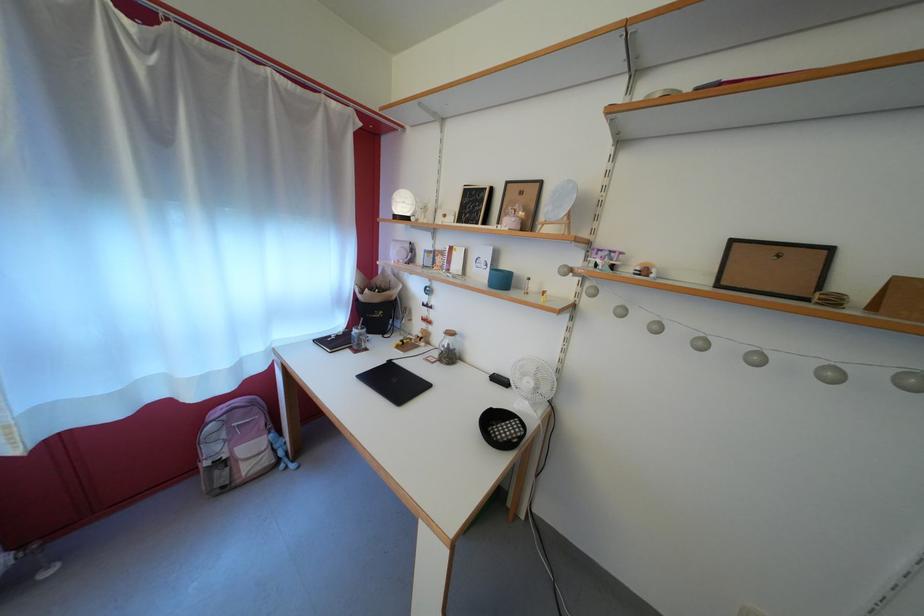
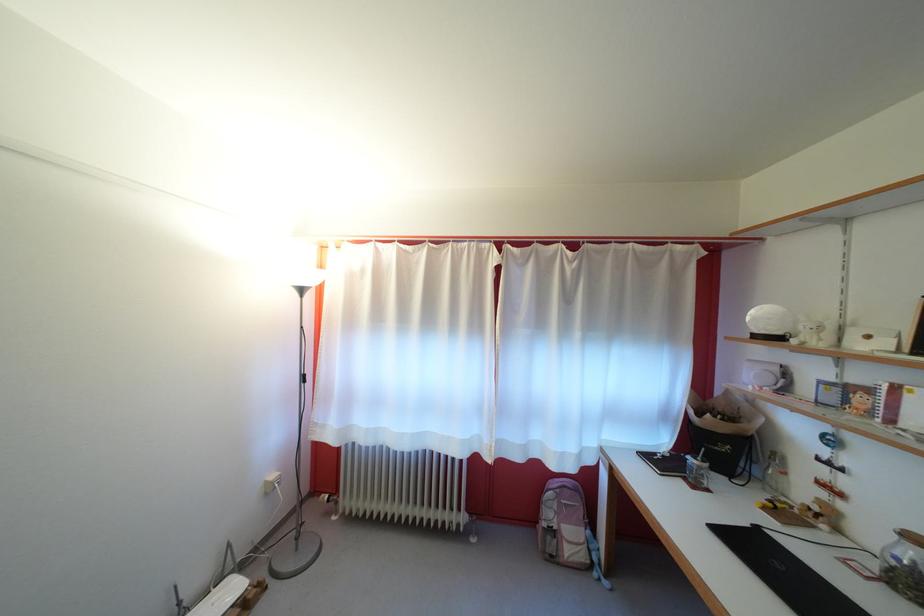
Find the pixel in the second image that matches the point at 368,341 in the first image.

(708, 474)